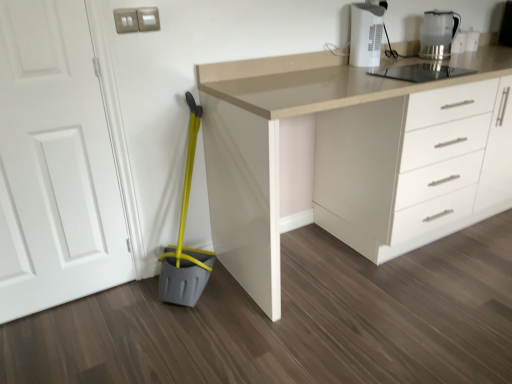
Question: Based on their positions, is white matte door at left located to the left or right of translucent glass kettle at upper right?

Choices:
 (A) right
 (B) left

Answer: (B)

Question: From the image's perspective, is white matte door at left above or below translucent glass kettle at upper right?

Choices:
 (A) below
 (B) above

Answer: (A)

Question: Based on their relative distances, which object is nearer to the translucent glass kettle at upper right?

Choices:
 (A) white matte door at left
 (B) white plastic coffee maker at upper right
 (C) beige laminate countertop at center

Answer: (B)

Question: Which of these objects is positioned closest to the white plastic coffee maker at upper right?

Choices:
 (A) beige laminate countertop at center
 (B) white matte door at left
 (C) translucent glass kettle at upper right

Answer: (C)